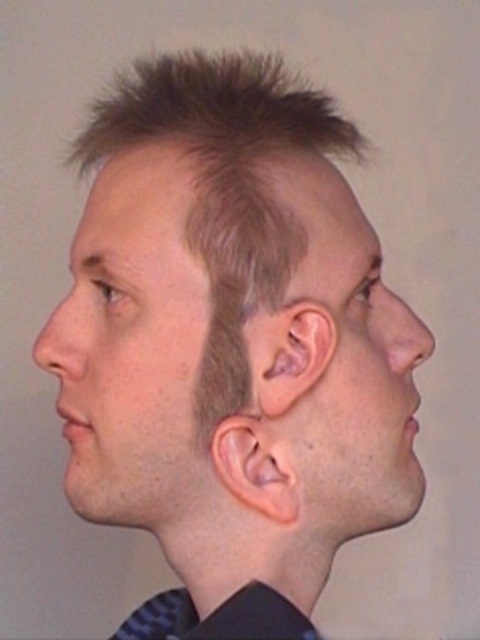
Question: Does pinkish matte ear at center appear under pinkish flesh-colored ear at center?

Choices:
 (A) yes
 (B) no

Answer: (B)

Question: Among these points, which one is farthest from the camera?

Choices:
 (A) (241, 484)
 (B) (252, 358)

Answer: (A)

Question: In this image, where is pinkish matte ear at center located relative to pinkish flesh-colored ear at center?

Choices:
 (A) left
 (B) right

Answer: (B)

Question: Which point appears farthest from the camera in this image?

Choices:
 (A) (327, 339)
 (B) (248, 444)

Answer: (B)

Question: Which object appears farthest from the camera in this image?

Choices:
 (A) pinkish matte ear at center
 (B) pinkish flesh-colored ear at center

Answer: (B)

Question: Can you confirm if pinkish matte ear at center is positioned below pinkish flesh-colored ear at center?

Choices:
 (A) yes
 (B) no

Answer: (B)